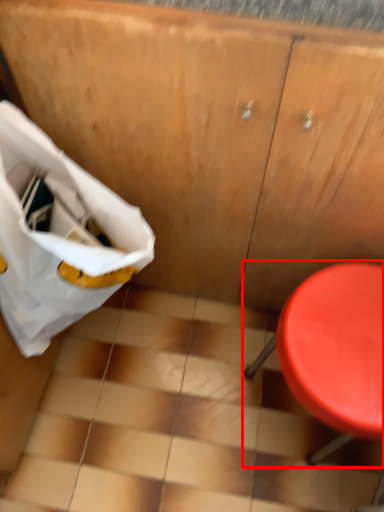
Question: Considering the relative positions of furniture (annotated by the red box) and grocery bag in the image provided, where is furniture (annotated by the red box) located with respect to the staircase?

Choices:
 (A) left
 (B) right

Answer: (B)